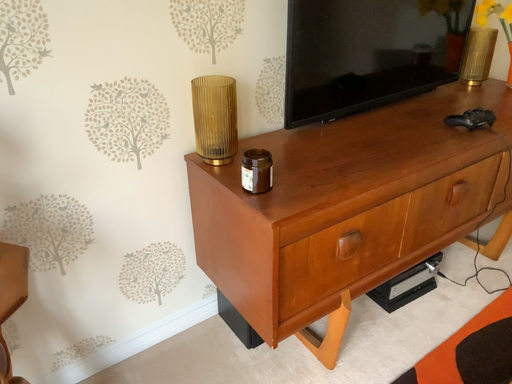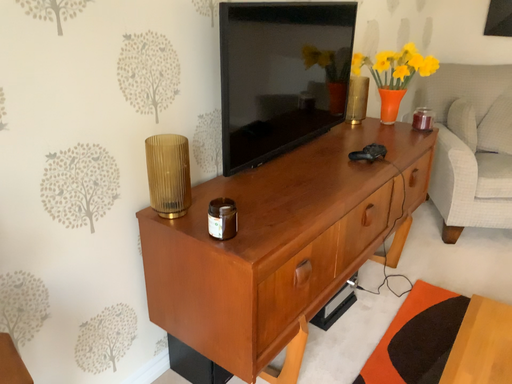
Question: How did the camera likely rotate when shooting the video?

Choices:
 (A) rotated left
 (B) rotated right

Answer: (B)